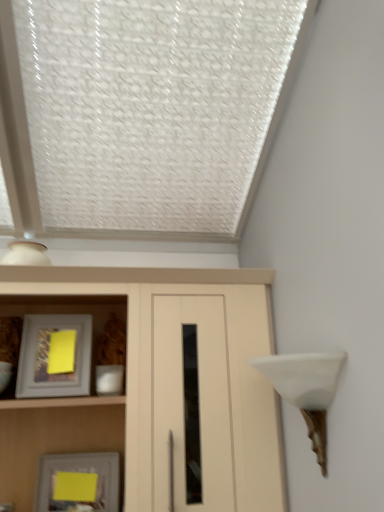
Find the location of a particular element. yellow paper at lower left, acting as the first picture frame starting from the bottom is located at coordinates (78, 482).

The image size is (384, 512). I want to click on matte gray picture frame at left, the first picture frame viewed from the top, so click(55, 356).

Which is farther, (140, 374) or (65, 489)?

The point (65, 489) is more distant.

Is matte wood cupboard at center thinner than yellow paper at lower left, positioned as the 2th picture frame in top-to-bottom order?

No.

You are a GUI agent. You are given a task and a screenshot of the screen. Output one action in this format:
    pyautogui.click(x=<x>, y=<y>)
    Task: Click on the picture frame below the matte wood cupboard at center (from a real-world perspective)
    The width and height of the screenshot is (384, 512).
    Given the screenshot: What is the action you would take?
    pyautogui.click(x=78, y=482)

Who is taller, matte wood cupboard at center or yellow paper at lower left, acting as the first picture frame starting from the bottom?

Standing taller between the two is matte wood cupboard at center.

Is yellow paper at lower left, acting as the first picture frame starting from the bottom, positioned with its back to white matte table lamp at right?

No, yellow paper at lower left, acting as the first picture frame starting from the bottom,'s orientation is not away from white matte table lamp at right.

From the image's perspective, between yellow paper at lower left, acting as the first picture frame starting from the bottom, and white matte table lamp at right, who is located below?

yellow paper at lower left, acting as the first picture frame starting from the bottom, is shown below in the image.

From a real-world perspective, is yellow paper at lower left, positioned as the 2th picture frame in top-to-bottom order, positioned above or below white matte table lamp at right?

From a real-world perspective, yellow paper at lower left, positioned as the 2th picture frame in top-to-bottom order, is physically below white matte table lamp at right.

Which object is closer to the camera taking this photo, matte gray picture frame at left, the 2th picture frame in the bottom-to-top sequence, or white matte table lamp at right?

white matte table lamp at right.

Considering the sizes of matte gray picture frame at left, the 2th picture frame in the bottom-to-top sequence, and white matte table lamp at right in the image, is matte gray picture frame at left, the 2th picture frame in the bottom-to-top sequence, taller or shorter than white matte table lamp at right?

In the image, matte gray picture frame at left, the 2th picture frame in the bottom-to-top sequence, appears to be shorter than white matte table lamp at right.

Is matte gray picture frame at left, the 2th picture frame in the bottom-to-top sequence, smaller than white matte table lamp at right?

Yes.

From the image's perspective, is matte gray picture frame at left, the 2th picture frame in the bottom-to-top sequence, above or below white matte table lamp at right?

From the image's perspective, matte gray picture frame at left, the 2th picture frame in the bottom-to-top sequence, appears above white matte table lamp at right.

Does white matte table lamp at right have a lesser width compared to matte gray picture frame at left, the first picture frame viewed from the top?

In fact, white matte table lamp at right might be wider than matte gray picture frame at left, the first picture frame viewed from the top.

Is matte gray picture frame at left, the 2th picture frame in the bottom-to-top sequence, a part of white matte table lamp at right?

No, matte gray picture frame at left, the 2th picture frame in the bottom-to-top sequence, is not a part of white matte table lamp at right.

From the image's perspective, is white matte table lamp at right above or below matte gray picture frame at left, the 2th picture frame in the bottom-to-top sequence?

white matte table lamp at right is below matte gray picture frame at left, the 2th picture frame in the bottom-to-top sequence.

Is white matte table lamp at right oriented towards matte gray picture frame at left, the first picture frame viewed from the top?

Yes, white matte table lamp at right is turned towards matte gray picture frame at left, the first picture frame viewed from the top.

Can you tell me how much matte wood cupboard at center and matte gray picture frame at left, the 2th picture frame in the bottom-to-top sequence, differ in facing direction?

The angular difference between matte wood cupboard at center and matte gray picture frame at left, the 2th picture frame in the bottom-to-top sequence, is 4.4 degrees.

Consider the image. Considering the relative sizes of matte wood cupboard at center and matte gray picture frame at left, the 2th picture frame in the bottom-to-top sequence, in the image provided, is matte wood cupboard at center thinner than matte gray picture frame at left, the 2th picture frame in the bottom-to-top sequence,?

In fact, matte wood cupboard at center might be wider than matte gray picture frame at left, the 2th picture frame in the bottom-to-top sequence.

Consider the image. From a real-world perspective, is matte wood cupboard at center above or below matte gray picture frame at left, the first picture frame viewed from the top?

matte wood cupboard at center is situated lower than matte gray picture frame at left, the first picture frame viewed from the top, in the real world.

Considering the relative sizes of matte wood cupboard at center and matte gray picture frame at left, the 2th picture frame in the bottom-to-top sequence, in the image provided, is matte wood cupboard at center smaller than matte gray picture frame at left, the 2th picture frame in the bottom-to-top sequence,?

A: Incorrect, matte wood cupboard at center is not smaller in size than matte gray picture frame at left, the 2th picture frame in the bottom-to-top sequence.

Looking at this image, choose the correct answer: Is matte wood cupboard at center inside white matte table lamp at right or outside it?

matte wood cupboard at center lies outside white matte table lamp at right.

What are the coordinates of `cupboard below the white matte table lamp at right (from the image's perspective)` in the screenshot? It's located at (152, 369).

Is the depth of matte wood cupboard at center greater than that of white matte table lamp at right?

Yes, matte wood cupboard at center is further from the camera.

From a real-world perspective, does matte wood cupboard at center stand above white matte table lamp at right?

Indeed, from a real-world perspective, matte wood cupboard at center stands above white matte table lamp at right.

Based on the photo, would you say matte gray picture frame at left, the 2th picture frame in the bottom-to-top sequence, is a long distance from yellow paper at lower left, acting as the first picture frame starting from the bottom?

No, matte gray picture frame at left, the 2th picture frame in the bottom-to-top sequence, is not far away from yellow paper at lower left, acting as the first picture frame starting from the bottom.

Is point (87, 347) in front of point (78, 493)?

No.

Consider the image. Between matte gray picture frame at left, the first picture frame viewed from the top, and yellow paper at lower left, positioned as the 2th picture frame in top-to-bottom order, which one has more height?

Standing taller between the two is matte gray picture frame at left, the first picture frame viewed from the top.

Identify the location of picture frame above the yellow paper at lower left, acting as the first picture frame starting from the bottom (from the image's perspective). (55, 356).

Image resolution: width=384 pixels, height=512 pixels. What are the coordinates of `cupboard above the yellow paper at lower left, positioned as the 2th picture frame in top-to-bottom order (from the image's perspective)` in the screenshot? It's located at (152, 369).

In the image, there is a white matte table lamp at right. At what (x,y) coordinates should I click in order to perform the action: click on picture frame below it (from the image's perspective). Please return your answer as a coordinate pair (x, y). Looking at the image, I should click on (78, 482).

Based on their spatial positions, is white matte table lamp at right or matte wood cupboard at center further from matte gray picture frame at left, the 2th picture frame in the bottom-to-top sequence?

The object further to matte gray picture frame at left, the 2th picture frame in the bottom-to-top sequence, is white matte table lamp at right.

Looking at the image, which one is located closer to matte wood cupboard at center, white matte table lamp at right or yellow paper at lower left, positioned as the 2th picture frame in top-to-bottom order?

white matte table lamp at right.

Looking at the image, which one is located further to yellow paper at lower left, positioned as the 2th picture frame in top-to-bottom order, matte wood cupboard at center or white matte table lamp at right?

Among the two, white matte table lamp at right is located further to yellow paper at lower left, positioned as the 2th picture frame in top-to-bottom order.

From the image, which object appears to be nearer to matte wood cupboard at center, white matte table lamp at right or matte gray picture frame at left, the first picture frame viewed from the top?

matte gray picture frame at left, the first picture frame viewed from the top, lies closer to matte wood cupboard at center than the other object.

Estimate the real-world distances between objects in this image. Which object is further from matte gray picture frame at left, the 2th picture frame in the bottom-to-top sequence, matte wood cupboard at center or yellow paper at lower left, positioned as the 2th picture frame in top-to-bottom order?

yellow paper at lower left, positioned as the 2th picture frame in top-to-bottom order, is further to matte gray picture frame at left, the 2th picture frame in the bottom-to-top sequence.

From the image, which object appears to be nearer to yellow paper at lower left, acting as the first picture frame starting from the bottom, matte gray picture frame at left, the first picture frame viewed from the top, or matte wood cupboard at center?

matte gray picture frame at left, the first picture frame viewed from the top, lies closer to yellow paper at lower left, acting as the first picture frame starting from the bottom, than the other object.

Estimate the real-world distances between objects in this image. Which object is closer to matte gray picture frame at left, the first picture frame viewed from the top, yellow paper at lower left, positioned as the 2th picture frame in top-to-bottom order, or white matte table lamp at right?

Among the two, yellow paper at lower left, positioned as the 2th picture frame in top-to-bottom order, is located nearer to matte gray picture frame at left, the first picture frame viewed from the top.

Considering their positions, is yellow paper at lower left, acting as the first picture frame starting from the bottom, positioned closer to white matte table lamp at right than matte wood cupboard at center?

matte wood cupboard at center is positioned closer to the anchor white matte table lamp at right.

Locate an element on the screen. cupboard that lies between matte gray picture frame at left, the 2th picture frame in the bottom-to-top sequence, and yellow paper at lower left, positioned as the 2th picture frame in top-to-bottom order, from top to bottom is located at coordinates (152, 369).

In order to click on picture frame between matte gray picture frame at left, the first picture frame viewed from the top, and white matte table lamp at right in this screenshot , I will do `click(78, 482)`.

The height and width of the screenshot is (512, 384). I want to click on cupboard between matte gray picture frame at left, the 2th picture frame in the bottom-to-top sequence, and white matte table lamp at right, in the horizontal direction, so click(152, 369).

Locate an element on the screen. cupboard between yellow paper at lower left, acting as the first picture frame starting from the bottom, and white matte table lamp at right is located at coordinates pyautogui.click(x=152, y=369).